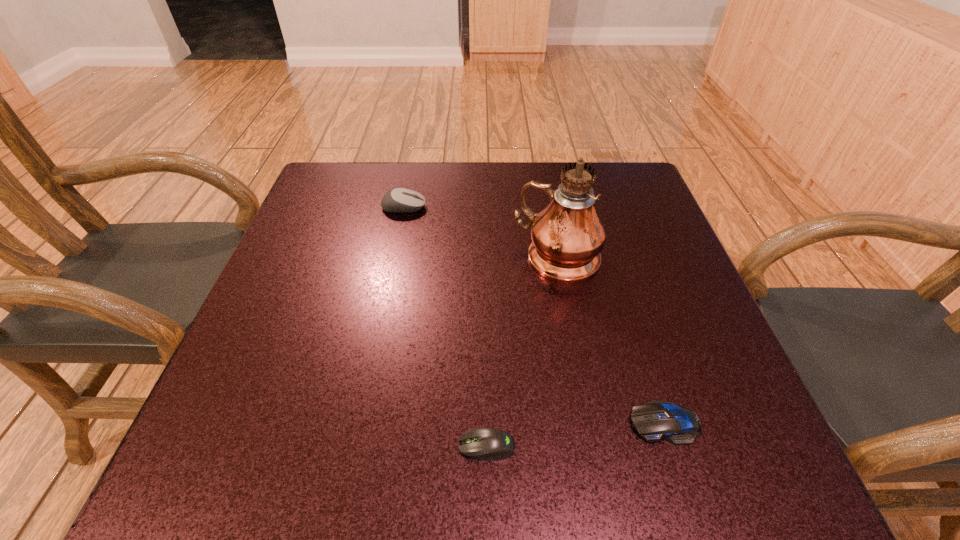
The width and height of the screenshot is (960, 540). What are the coordinates of `unoccupied position between the rightmost computer mouse and the tallest object` in the screenshot? It's located at (611, 340).

Find the location of a particular element. free point between the rightmost computer mouse and the second tallest object is located at coordinates (534, 315).

Image resolution: width=960 pixels, height=540 pixels. I want to click on free space between the tallest object and the second object from left to right, so click(522, 352).

Where is `unoccupied position between the second computer mouse from left to right and the tallest computer mouse`? The image size is (960, 540). unoccupied position between the second computer mouse from left to right and the tallest computer mouse is located at coordinates (445, 326).

Image resolution: width=960 pixels, height=540 pixels. In order to click on vacant area that lies between the third nearest object and the rightmost computer mouse in this screenshot , I will do `click(611, 340)`.

Choose which object is the second nearest neighbor to the rightmost computer mouse. Please provide its 2D coordinates. Your answer should be formatted as a tuple, i.e. [(x, y)], where the tuple contains the x and y coordinates of a point satisfying the conditions above.

[(567, 236)]

Find the location of a particular element. the second closest object to the rightmost computer mouse is located at coordinates (567, 236).

This screenshot has height=540, width=960. In order to click on the closest computer mouse to the second farthest object in this screenshot , I will do click(x=399, y=200).

Locate an element on the screen. The image size is (960, 540). computer mouse that stands as the closest to the second computer mouse from left to right is located at coordinates click(x=658, y=419).

Where is `vacant space that satisfies the following two spatial constraints: 1. on the back side of the tallest object; 2. on the wheel side of the leftmost computer mouse`? The width and height of the screenshot is (960, 540). vacant space that satisfies the following two spatial constraints: 1. on the back side of the tallest object; 2. on the wheel side of the leftmost computer mouse is located at coordinates (548, 207).